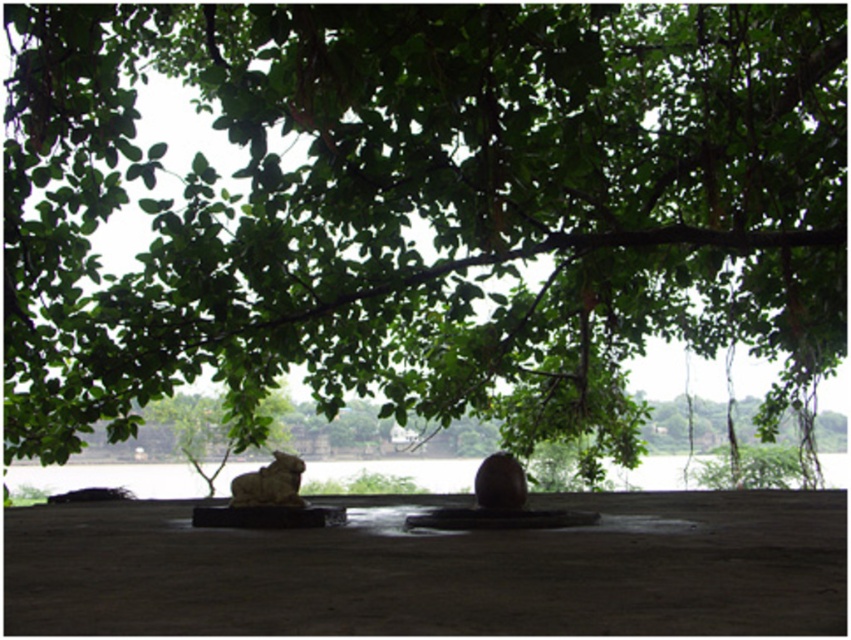
Is the position of clear water at center more distant than that of matte brown stone at center?

Yes.

Which is in front, point (141, 467) or point (506, 481)?

Point (506, 481) is more forward.

Which is in front, point (672, 483) or point (501, 456)?

Positioned in front is point (501, 456).

This screenshot has width=851, height=640. I want to click on clear water at center, so click(111, 477).

Does clear water at center have a larger size compared to gray stone statue at center?

Correct, clear water at center is larger in size than gray stone statue at center.

How distant is clear water at center from gray stone statue at center?

clear water at center is 19.36 feet from gray stone statue at center.

Between point (53, 477) and point (290, 465), which one is positioned behind?

Point (53, 477)

Identify the location of clear water at center. (111, 477).

Is gray stone statue at center bigger than matte brown stone at center?

Indeed, gray stone statue at center has a larger size compared to matte brown stone at center.

Which is in front, point (252, 484) or point (488, 472)?

Point (488, 472) is in front.

Does point (283, 474) lie behind point (493, 468)?

Yes.

Where is `gray stone statue at center`? The height and width of the screenshot is (640, 851). gray stone statue at center is located at coordinates (269, 483).